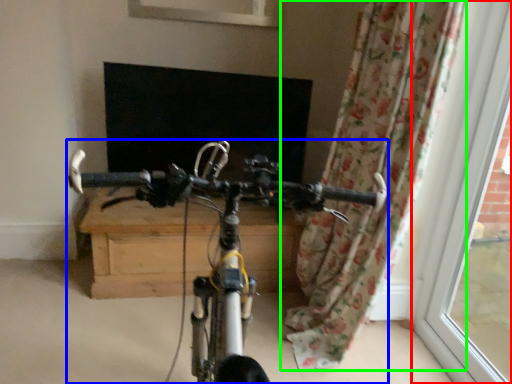
Question: Based on their relative distances, which object is nearer to window frame (highlighted by a red box)? Choose from bicycle (highlighted by a blue box) and curtain (highlighted by a green box).

Choices:
 (A) bicycle
 (B) curtain

Answer: (B)